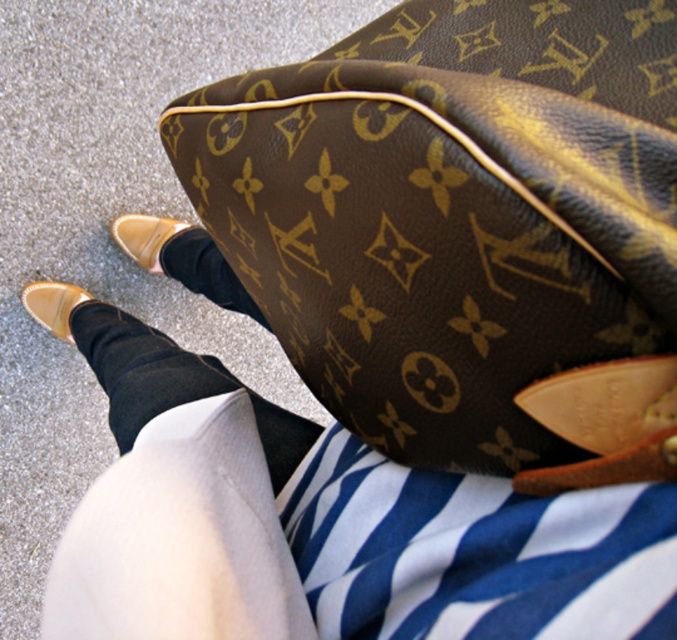
You are a fashion stylist trying to style a client for an event. You have a brown leather bag at upper center and a black smooth sock at lower center. The client wants to know if these two items can be placed together in a small handbag compartment that can only hold items within 10 inches apart. Can they fit?

The brown leather bag at upper center and black smooth sock at lower center are 10.77 inches apart, so they cannot fit into the compartment since the required space exceeds the 10 inches limit.

You are a fashion designer observing the image. You need to determine the spatial relationship between the brown leather bag at upper center and the black smooth sock at lower center. Which object is positioned higher in the image?

The brown leather bag at upper center is positioned higher in the image than the black smooth sock at lower center.

You are a delivery person who needs to place a small package in the image. The package is 15 cm in length. Which object can it fit into, the brown leather bag at upper center or the matte tan leather shoe at lower left?

The brown leather bag at upper center has a larger size compared to the matte tan leather shoe at lower left, so the small package of 15 cm can fit into the brown leather bag at upper center.